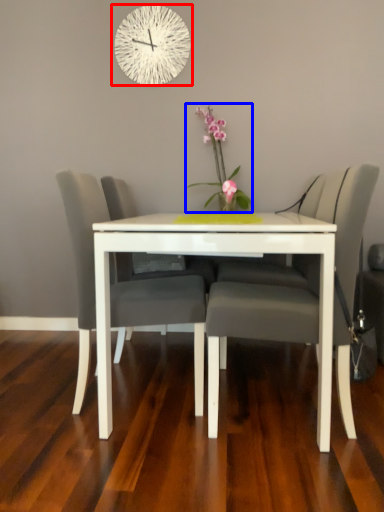
Question: Among these objects, which one is nearest to the camera, wall clock (highlighted by a red box) or floral arrangement (highlighted by a blue box)?

Choices:
 (A) wall clock
 (B) floral arrangement

Answer: (B)